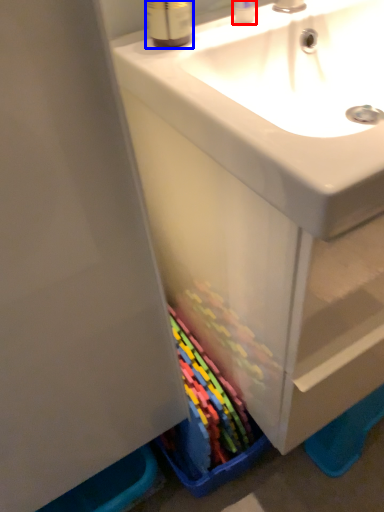
Question: Among these objects, which one is nearest to the camera, toiletry (highlighted by a red box) or mouthwash (highlighted by a blue box)?

Choices:
 (A) toiletry
 (B) mouthwash

Answer: (B)